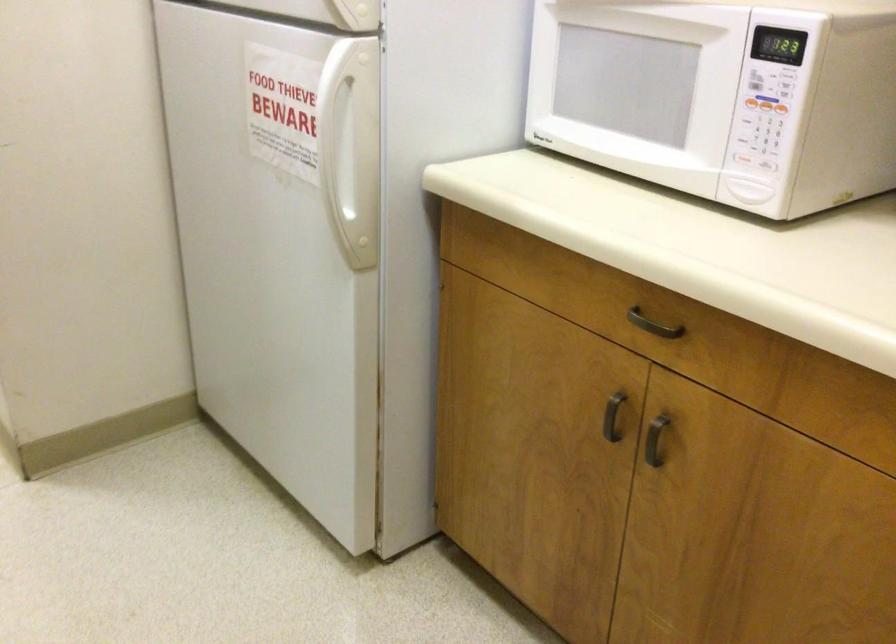
Describe the element at coordinates (741, 158) in the screenshot. The width and height of the screenshot is (896, 644). I see `a microwave door button` at that location.